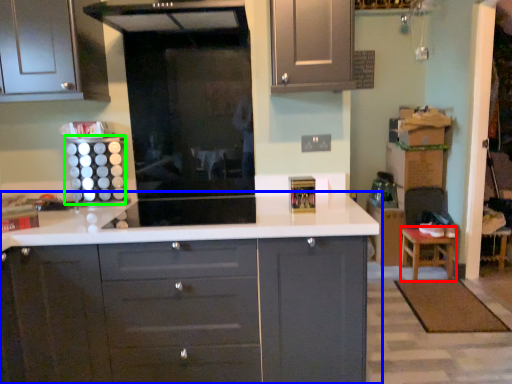
Question: Estimate the real-world distances between objects in this image. Which object is farther from stool (highlighted by a red box), countertop (highlighted by a blue box) or appliance (highlighted by a green box)?

Choices:
 (A) countertop
 (B) appliance

Answer: (B)